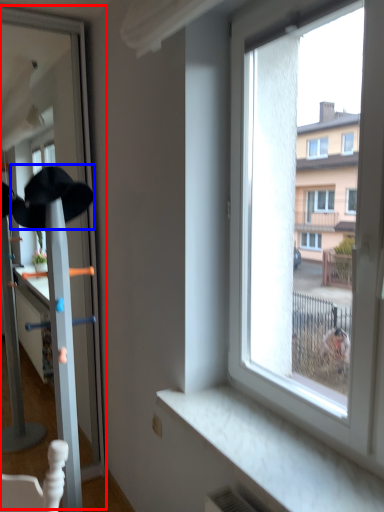
Question: Which point is closer to the camera, screen door (highlighted by a red box) or baseball hat (highlighted by a blue box)?

Choices:
 (A) screen door
 (B) baseball hat

Answer: (A)